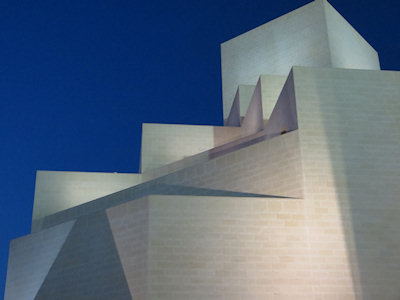
Where is `lighted area of brick`? This screenshot has height=300, width=400. lighted area of brick is located at coordinates (317, 245).